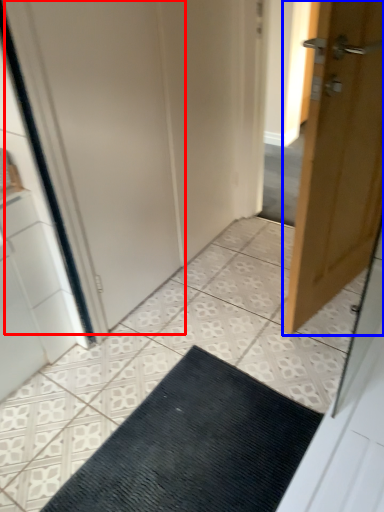
Question: Which of the following is the closest to the observer, screen door (highlighted by a red box) or door (highlighted by a blue box)?

Choices:
 (A) screen door
 (B) door

Answer: (B)